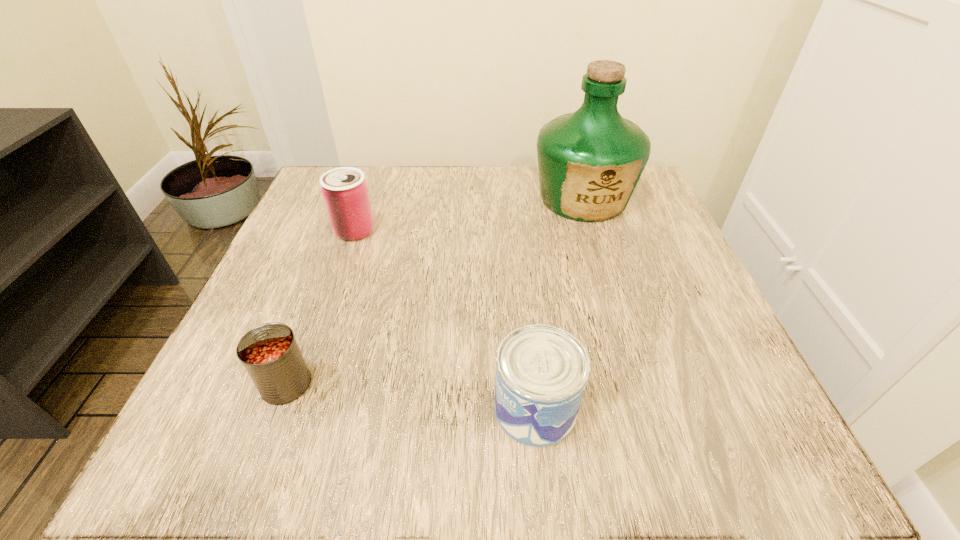
Where is `free spot between the farthest can and the rightmost can`? Image resolution: width=960 pixels, height=540 pixels. free spot between the farthest can and the rightmost can is located at coordinates (445, 320).

Find the location of a particular element. This screenshot has width=960, height=540. empty location between the liquor and the rightmost can is located at coordinates (560, 303).

Image resolution: width=960 pixels, height=540 pixels. In order to click on free spot between the farthest can and the tallest object in this screenshot , I will do `click(468, 214)`.

What are the coordinates of `vacant space in between the rightmost can and the farthest can` in the screenshot? It's located at (445, 320).

The width and height of the screenshot is (960, 540). I want to click on empty location between the rightmost can and the liquor, so click(x=560, y=303).

Find the location of a particular element. free area in between the rightmost can and the farthest can is located at coordinates (445, 320).

You are a GUI agent. You are given a task and a screenshot of the screen. Output one action in this format:
    pyautogui.click(x=<x>, y=<y>)
    Task: Click on the unoccupied position between the tallest object and the farthest can
    The width and height of the screenshot is (960, 540).
    Given the screenshot: What is the action you would take?
    pyautogui.click(x=468, y=214)

Identify the location of unoccupied position between the rightmost can and the liquor. Image resolution: width=960 pixels, height=540 pixels. (560, 303).

Identify the location of the third closest object to the rightmost can. (345, 192).

This screenshot has width=960, height=540. Find the location of `object that is the third closest one to the tallest object`. object that is the third closest one to the tallest object is located at coordinates (269, 352).